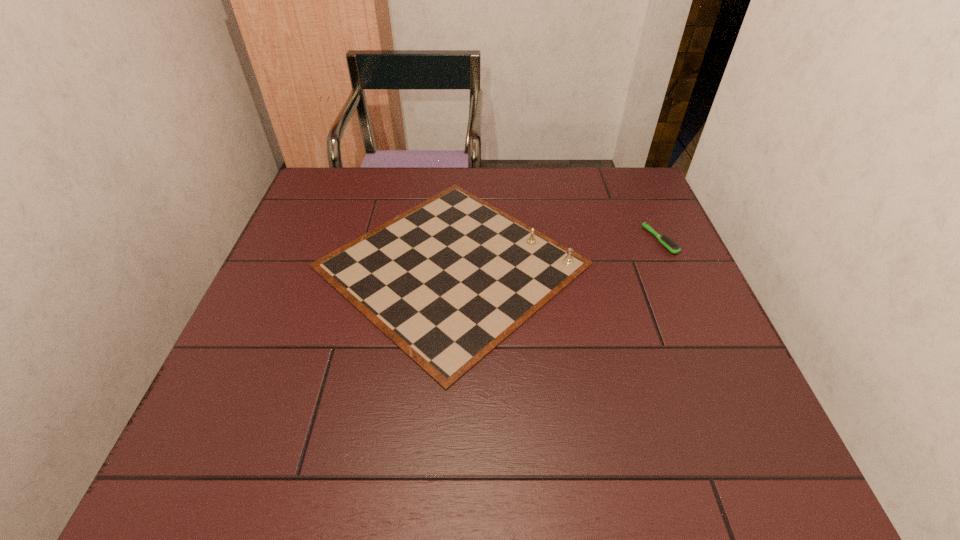
Find the location of `the left object`. the left object is located at coordinates pos(447,281).

Identify the location of gameboard. (447, 281).

Locate an element on the screen. hairbrush is located at coordinates (674, 248).

This screenshot has width=960, height=540. In order to click on the right object in this screenshot , I will do `click(674, 248)`.

Locate an element on the screen. The width and height of the screenshot is (960, 540). free space located on the right of the gameboard is located at coordinates (633, 265).

You are a GUI agent. You are given a task and a screenshot of the screen. Output one action in this format:
    pyautogui.click(x=<x>, y=<y>)
    Task: Click on the vacant area situated on the front of the right object
    
    Given the screenshot: What is the action you would take?
    pyautogui.click(x=675, y=274)

Locate an element on the screen. The height and width of the screenshot is (540, 960). object that is at the far edge is located at coordinates [447, 281].

Find the location of a particular element. This screenshot has height=540, width=960. object at the left edge is located at coordinates (447, 281).

At what (x,y) coordinates should I click in order to perform the action: click on object positioned at the right edge. Please return your answer as a coordinate pair (x, y). The height and width of the screenshot is (540, 960). Looking at the image, I should click on (674, 248).

I want to click on object that is positioned at the far left corner, so pyautogui.click(x=447, y=281).